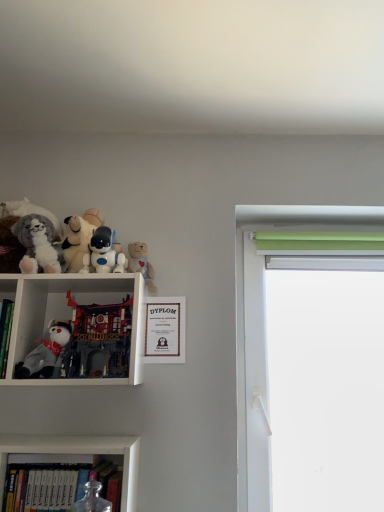
Question: From a real-world perspective, is white plush bear at upper center, marked as the first toy in a right-to-left arrangement, above or below matte gold picture frame at center?

Choices:
 (A) below
 (B) above

Answer: (B)

Question: Is white plush bear at upper center, positioned as the sixth toy in left-to-right order, in front of or behind matte gold picture frame at center in the image?

Choices:
 (A) front
 (B) behind

Answer: (A)

Question: Estimate the real-world distances between objects in this image. Which object is closer to the white plush toy at left, which is the fifth toy from right to left?

Choices:
 (A) matte red and black castle at left, acting as the third toy starting from the right
 (B) fluffy plush cat at left, the sixth toy in the right-to-left sequence
 (C) hardcover books at lower left, the 2th bookcase in the top-to-bottom sequence
 (D) matte gold picture frame at center
 (E) white plush bear at upper center, marked as the first toy in a right-to-left arrangement

Answer: (A)

Question: Which object is the closest to the white matte robot at upper left, the 2th toy in the right-to-left sequence?

Choices:
 (A) matte red and black castle at left, acting as the third toy starting from the right
 (B) matte gold picture frame at center
 (C) white plush toy at left, acting as the third toy starting from the left
 (D) white plush bear at upper center, positioned as the sixth toy in left-to-right order
 (E) hardcover books at lower left, placed as the first bookcase when sorted from bottom to top

Answer: (C)